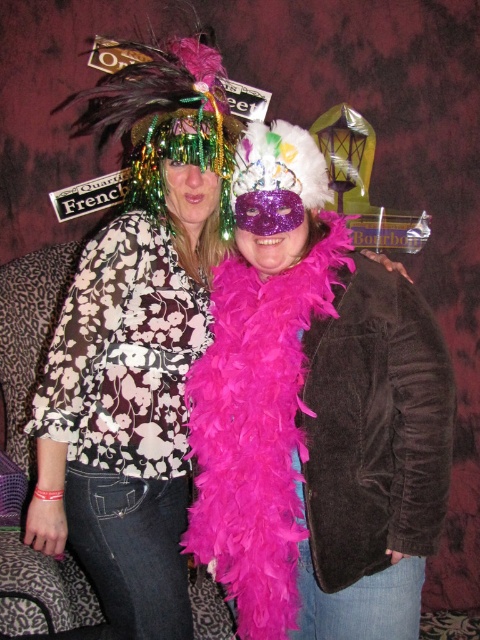
Question: Which of these objects is positioned closest to the pink feather boa at center?

Choices:
 (A) floral print blouse at left
 (B) feathered headdress at upper center

Answer: (A)

Question: Where is pink feather boa at center located in relation to floral print blouse at left in the image?

Choices:
 (A) above
 (B) below

Answer: (A)

Question: Does pink feather boa at center come in front of feathered headdress at upper center?

Choices:
 (A) no
 (B) yes

Answer: (B)

Question: Among these objects, which one is nearest to the camera?

Choices:
 (A) feathered headdress at upper center
 (B) floral print blouse at left

Answer: (B)

Question: Is floral print blouse at left bigger than feathered headdress at upper center?

Choices:
 (A) no
 (B) yes

Answer: (B)

Question: Among these points, which one is nearest to the camera?

Choices:
 (A) (95, 506)
 (B) (192, 74)

Answer: (A)